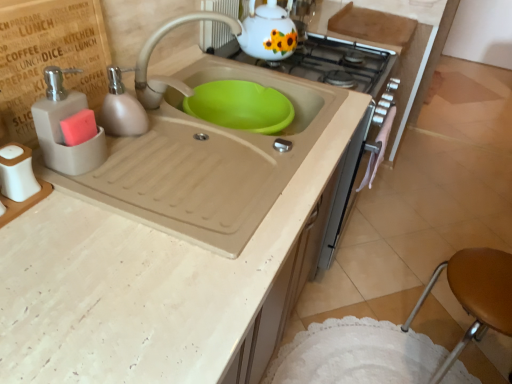
Where is `vacant region to the right of matte beige soap dispenser at left, the second soap dispenser in the front-to-back sequence`? This screenshot has width=512, height=384. vacant region to the right of matte beige soap dispenser at left, the second soap dispenser in the front-to-back sequence is located at coordinates (191, 142).